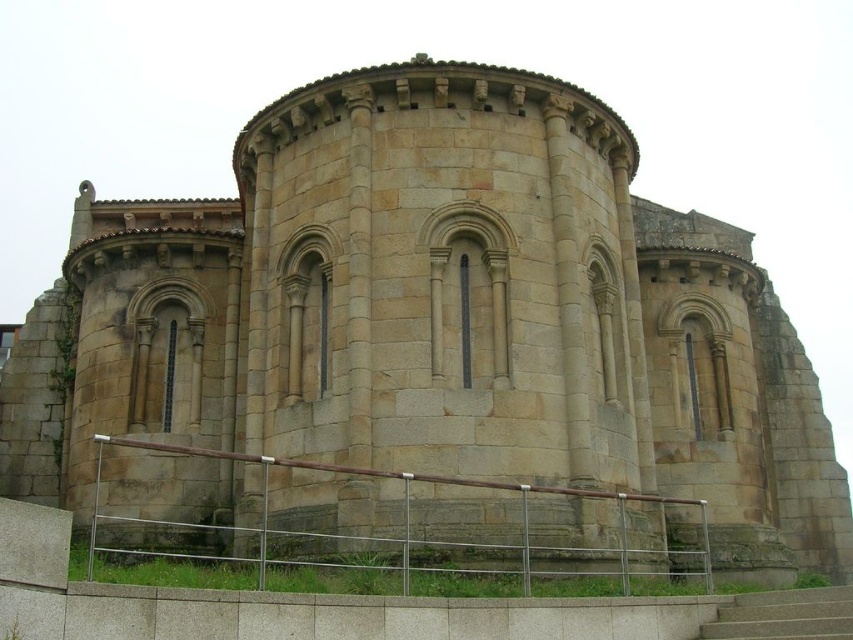
Is silver metallic railing at lower center wider than smooth concrete stairs at lower center?

Yes.

Which is below, silver metallic railing at lower center or smooth concrete stairs at lower center?

Positioned lower is smooth concrete stairs at lower center.

Where is `silver metallic railing at lower center`? The width and height of the screenshot is (853, 640). silver metallic railing at lower center is located at coordinates (409, 528).

Where is `silver metallic railing at lower center`? Image resolution: width=853 pixels, height=640 pixels. silver metallic railing at lower center is located at coordinates (409, 528).